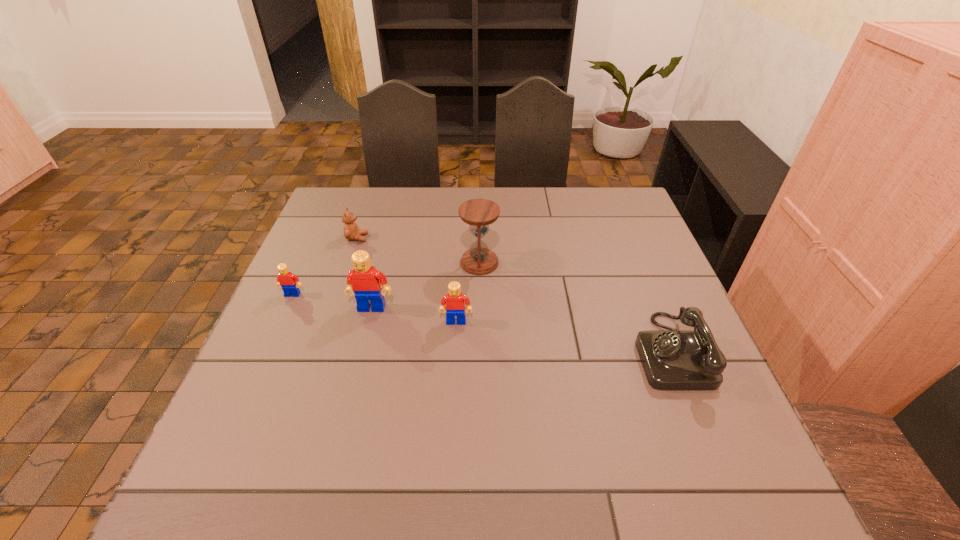
Find the location of a particular element. The width and height of the screenshot is (960, 540). the shortest Lego is located at coordinates (285, 278).

Where is `the leftmost object`? the leftmost object is located at coordinates pos(285,278).

Locate an element on the screen. the fourth farthest object is located at coordinates (364, 280).

Identify the location of the second farthest Lego. (364, 280).

The width and height of the screenshot is (960, 540). Find the location of `the rightmost Lego`. the rightmost Lego is located at coordinates (455, 301).

In order to click on the second tallest Lego in this screenshot , I will do `click(455, 301)`.

This screenshot has width=960, height=540. What are the coordinates of `the fifth nearest object` in the screenshot? It's located at (479, 260).

Where is `teddy bear`? teddy bear is located at coordinates (351, 232).

Find the location of a particular element. This screenshot has height=540, width=960. the farthest object is located at coordinates pyautogui.click(x=351, y=232).

Where is `the rightmost object`? The width and height of the screenshot is (960, 540). the rightmost object is located at coordinates (674, 360).